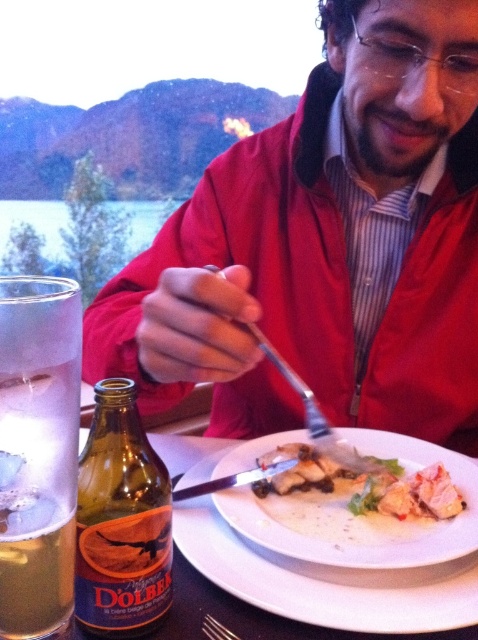
You are a waiter at the table. You need to place a napkin on the table. Where should you put it so it doesn t interfere with the existing items? Consider the positions of the white matte plate at center and the satin silver fork at plate center.

The white matte plate at center is to the right of the satin silver fork at plate center. To avoid interference, place the napkin to the left of the satin silver fork at plate center or to the right of the white matte plate at center.

You are a server at a restaurant and need to clear the table. The plate and bottle must be placed in a dishwasher that has a maximum load size of 30 cm. Given that the white ceramic plate at center is larger than the brown glass bottle at lower left, can both items fit into the dishwasher together?

The white ceramic plate at center is larger in size than the brown glass bottle at lower left. Since the dishwasher has a maximum load size of 30 cm, both items can fit together as long as their combined dimensions do not exceed the dishwasher capacity. However, the exact sizes are not provided, so it depends on whether each item individually fits within the 30 cm limit.

You are a person with a 12 inch long arm. You are sitting at the table and want to reach the white matte plate at center. Can you reach it?

The white matte plate at center is 14.89 inches away from you, which is farther than your 12 inch arm length. You cannot reach it.